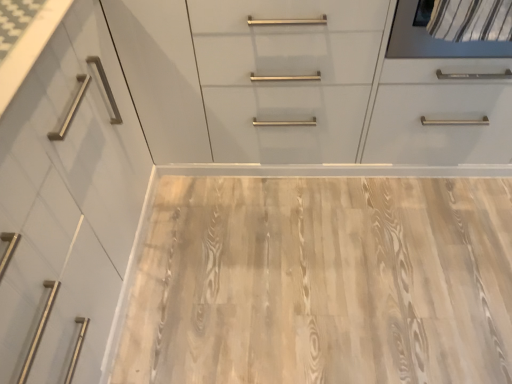
Question: Does white glossy cabinet at upper center have a larger size compared to light wood/texture plywood at center?

Choices:
 (A) no
 (B) yes

Answer: (B)

Question: From a real-world perspective, is white glossy cabinet at upper center beneath light wood/texture plywood at center?

Choices:
 (A) yes
 (B) no

Answer: (B)

Question: Is white glossy cabinet at upper center shorter than light wood/texture plywood at center?

Choices:
 (A) yes
 (B) no

Answer: (B)

Question: Is white glossy cabinet at upper center completely or partially outside of light wood/texture plywood at center?

Choices:
 (A) no
 (B) yes

Answer: (B)

Question: Is white glossy cabinet at upper center oriented towards light wood/texture plywood at center?

Choices:
 (A) yes
 (B) no

Answer: (A)

Question: Does white glossy cabinet at upper center have a smaller size compared to light wood/texture plywood at center?

Choices:
 (A) yes
 (B) no

Answer: (B)

Question: Is light wood/texture plywood at center not inside white glossy cabinet at upper center?

Choices:
 (A) no
 (B) yes

Answer: (B)

Question: Is light wood/texture plywood at center positioned before white glossy cabinet at upper center?

Choices:
 (A) no
 (B) yes

Answer: (A)

Question: Could you tell me if light wood/texture plywood at center is turned towards white glossy cabinet at upper center?

Choices:
 (A) no
 (B) yes

Answer: (A)

Question: From the image's perspective, is light wood/texture plywood at center beneath white glossy cabinet at upper center?

Choices:
 (A) yes
 (B) no

Answer: (A)

Question: Is light wood/texture plywood at center facing away from white glossy cabinet at upper center?

Choices:
 (A) no
 (B) yes

Answer: (A)

Question: From a real-world perspective, is light wood/texture plywood at center located higher than white glossy cabinet at upper center?

Choices:
 (A) no
 (B) yes

Answer: (A)

Question: Considering the positions of light wood/texture plywood at center and white glossy cabinet at upper center in the image, is light wood/texture plywood at center wider or thinner than white glossy cabinet at upper center?

Choices:
 (A) wide
 (B) thin

Answer: (A)